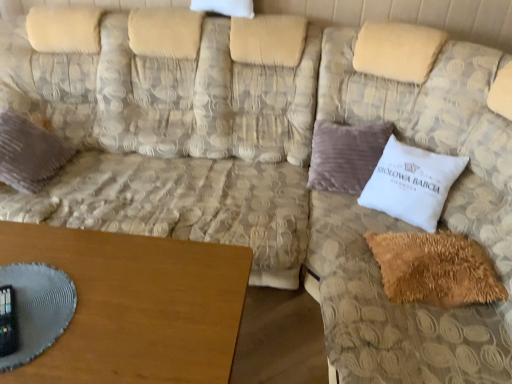
The width and height of the screenshot is (512, 384). I want to click on free space above brown wooden table at lower left (from a real-world perspective), so pos(101,294).